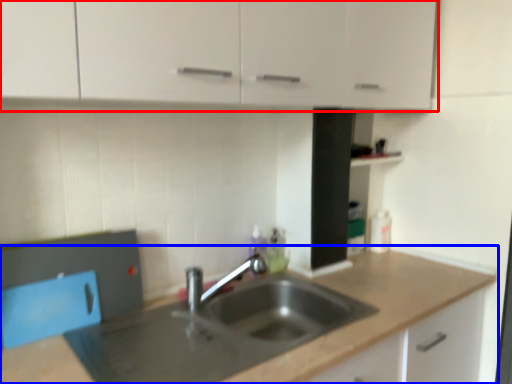
Question: Which point is closer to the camera, cabinetry (highlighted by a red box) or countertop (highlighted by a blue box)?

Choices:
 (A) cabinetry
 (B) countertop

Answer: (A)